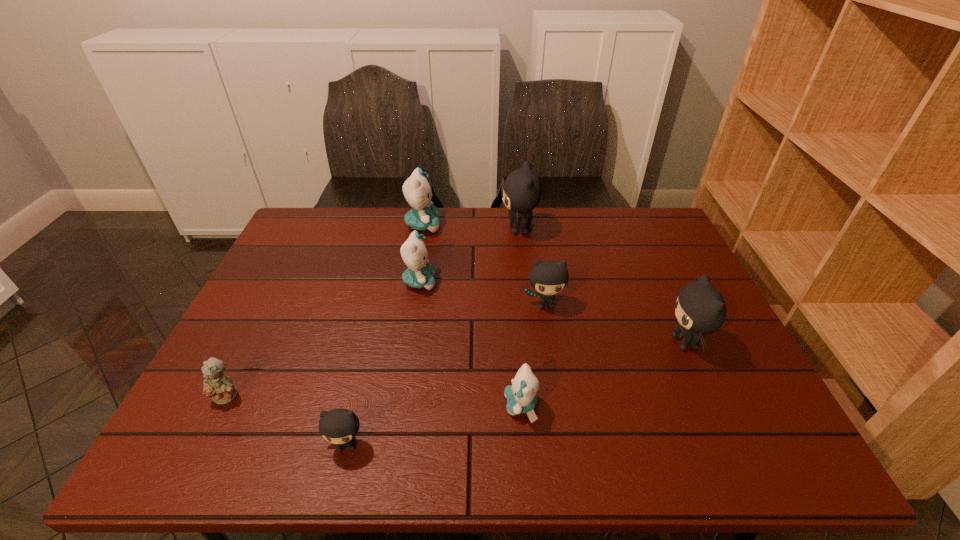
Locate an element on the screen. The height and width of the screenshot is (540, 960). free space between the biggest blue kitten and the smallest blue kitten is located at coordinates (472, 315).

You are a GUI agent. You are given a task and a screenshot of the screen. Output one action in this format:
    pyautogui.click(x=<x>, y=<y>)
    Task: Click on the free spot between the rightmost kitten and the nearest blue kitten
    This screenshot has height=540, width=960.
    Given the screenshot: What is the action you would take?
    point(603,374)

At what (x,y) coordinates should I click in order to perform the action: click on the sixth closest object to the blue teddy bear. Please return your answer as a coordinate pair (x, y). Looking at the image, I should click on (522, 190).

Locate an element on the screen. object that is the fourth closest to the rightmost object is located at coordinates (420, 273).

At what (x,y) coordinates should I click in order to perform the action: click on the fourth closest kitten to the biggest gray kitten. Please return your answer as a coordinate pair (x, y). The width and height of the screenshot is (960, 540). Looking at the image, I should click on (700, 309).

This screenshot has width=960, height=540. I want to click on kitten that stands as the third closest to the rightmost gray kitten, so click(x=522, y=190).

At what (x,y) coordinates should I click in order to perform the action: click on gray kitten that can be found as the second closest to the second smallest blue kitten. Please return your answer as a coordinate pair (x, y). Looking at the image, I should click on (548, 278).

This screenshot has width=960, height=540. Find the location of `the fourth closest gray kitten relative to the farthest blue kitten`. the fourth closest gray kitten relative to the farthest blue kitten is located at coordinates (700, 309).

Point out which blue kitten is positioned as the nearest to the second nearest blue kitten. Please provide its 2D coordinates. Your answer should be formatted as a tuple, i.e. [(x, y)], where the tuple contains the x and y coordinates of a point satisfying the conditions above.

[(416, 189)]

Identify the location of the second closest blue kitten relative to the second smallest blue kitten. (521, 396).